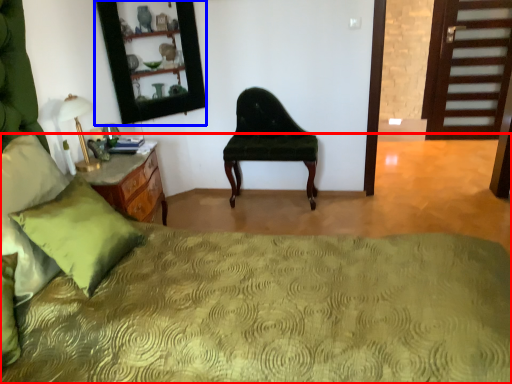
Question: Which point is further to the camera, bed (highlighted by a red box) or mirror (highlighted by a blue box)?

Choices:
 (A) bed
 (B) mirror

Answer: (B)